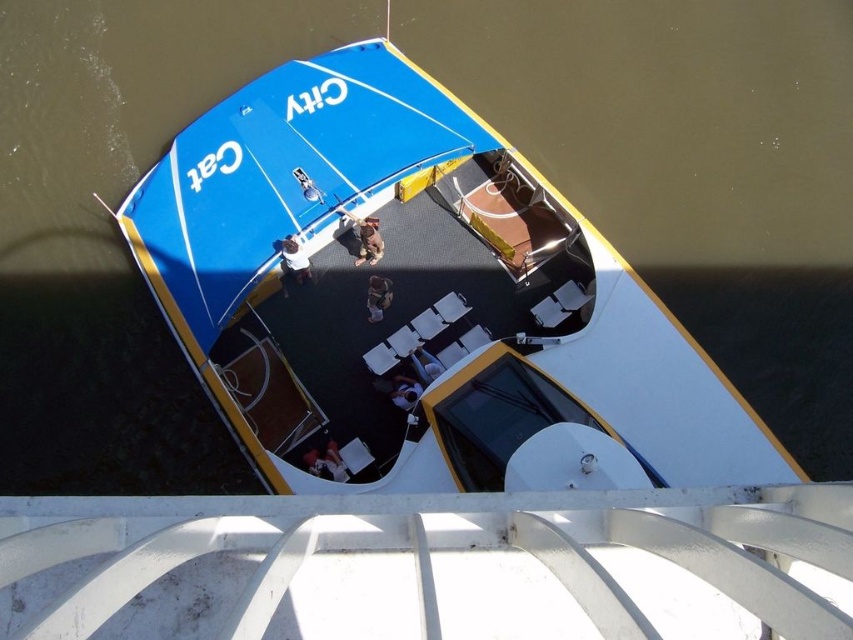
Question: Which object is closer to the camera taking this photo?

Choices:
 (A) white plastic chairs at center
 (B) white fabric bag at center

Answer: (A)

Question: Is white plastic chairs at center closer to camera compared to white fabric bag at center?

Choices:
 (A) no
 (B) yes

Answer: (B)

Question: Considering the relative positions of brown fabric bag at center and white fabric bag at center in the image provided, where is brown fabric bag at center located with respect to white fabric bag at center?

Choices:
 (A) below
 (B) above

Answer: (B)

Question: Among these objects, which one is nearest to the camera?

Choices:
 (A) white fabric bag at center
 (B) white fabric shirt at center
 (C) white plastic chairs at center

Answer: (C)

Question: Can you confirm if brown fabric bag at center is positioned below brown leather jacket at center?

Choices:
 (A) yes
 (B) no

Answer: (B)

Question: Which point is farther from the camera taking this photo?

Choices:
 (A) (270, 440)
 (B) (293, 241)

Answer: (A)